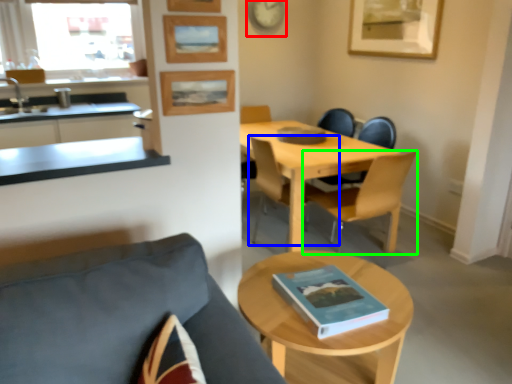
Question: Estimate the real-world distances between objects in this image. Which object is farther from clock (highlighted by a red box), chair (highlighted by a blue box) or chair (highlighted by a green box)?

Choices:
 (A) chair
 (B) chair

Answer: (B)